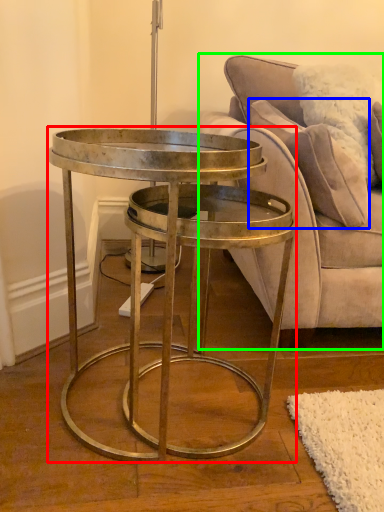
Question: Considering the real-world distances, which object is closest to coffee table (highlighted by a red box)? pillow (highlighted by a blue box) or studio couch (highlighted by a green box).

Choices:
 (A) pillow
 (B) studio couch

Answer: (B)